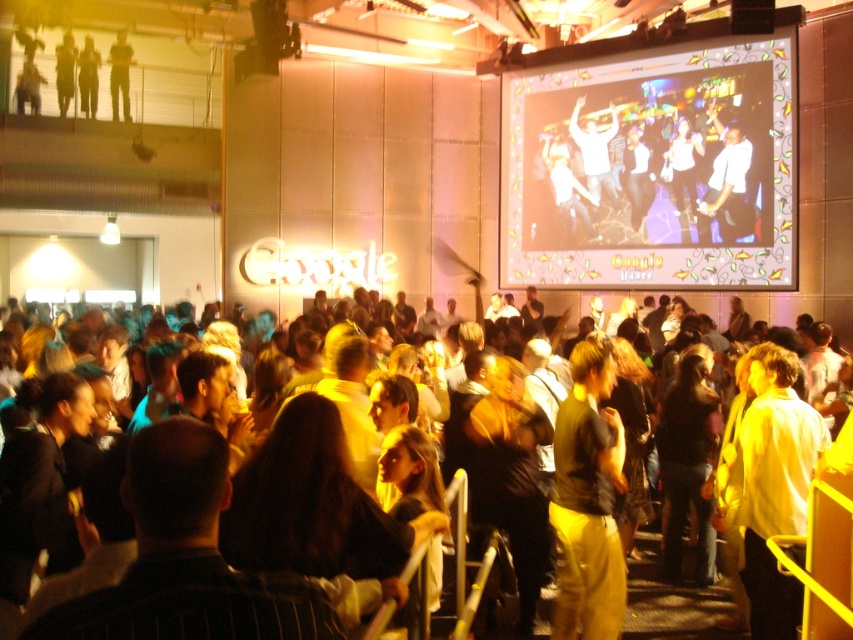
Who is positioned more to the left, white fabric shirt at upper center or dark gray pants at upper left?

Positioned to the left is dark gray pants at upper left.

Based on the photo, can you confirm if white fabric shirt at upper center is positioned to the left of dark gray pants at upper left?

Incorrect, white fabric shirt at upper center is not on the left side of dark gray pants at upper left.

Image resolution: width=853 pixels, height=640 pixels. Identify the location of white fabric shirt at upper center. (567, 192).

Where is `white fabric shirt at upper center`? white fabric shirt at upper center is located at coordinates (567, 192).

Does white fabric shirt at upper center have a larger size compared to light brown leather jacket at upper left?

No.

Measure the distance between white fabric shirt at upper center and light brown leather jacket at upper left.

They are 52.26 feet apart.

Identify the location of white fabric shirt at upper center. (567, 192).

Find the location of a particular element. white fabric shirt at upper center is located at coordinates (567, 192).

From the picture: Does yellow fabric shirt at center lie in front of light brown leather jacket at upper left?

Yes, yellow fabric shirt at center is closer to the viewer.

This screenshot has height=640, width=853. I want to click on yellow fabric shirt at center, so click(x=589, y=500).